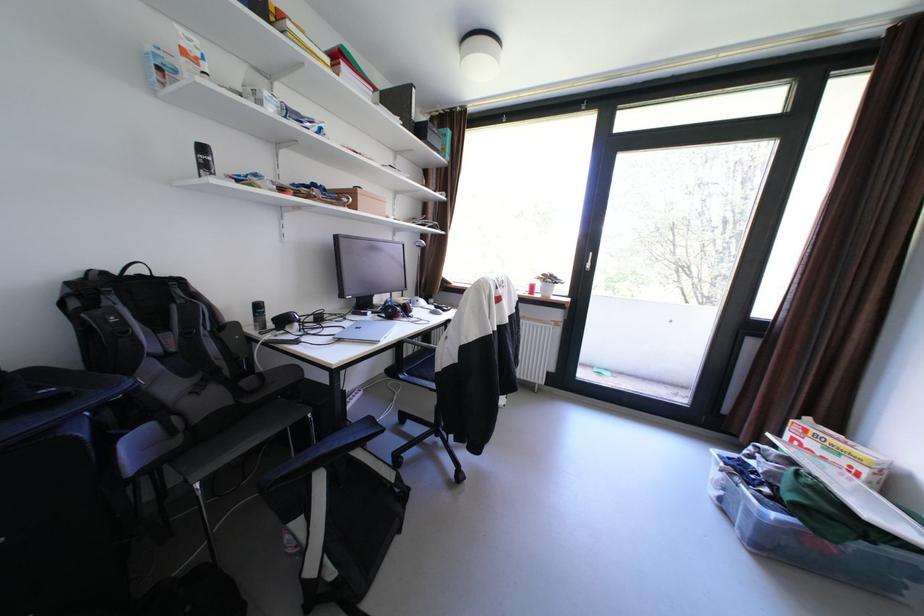
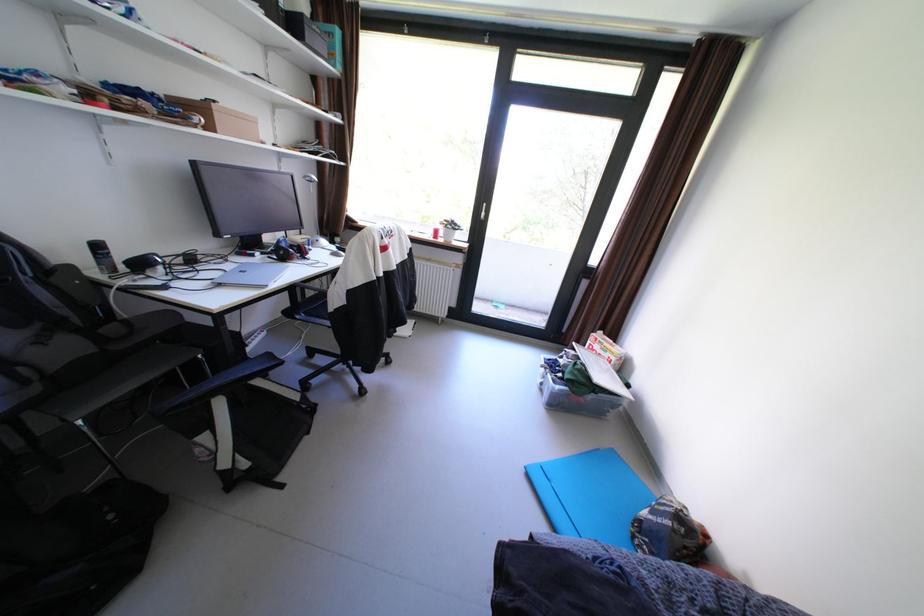
Locate, in the second image, the point that corresponds to (762,463) in the first image.

(572, 361)